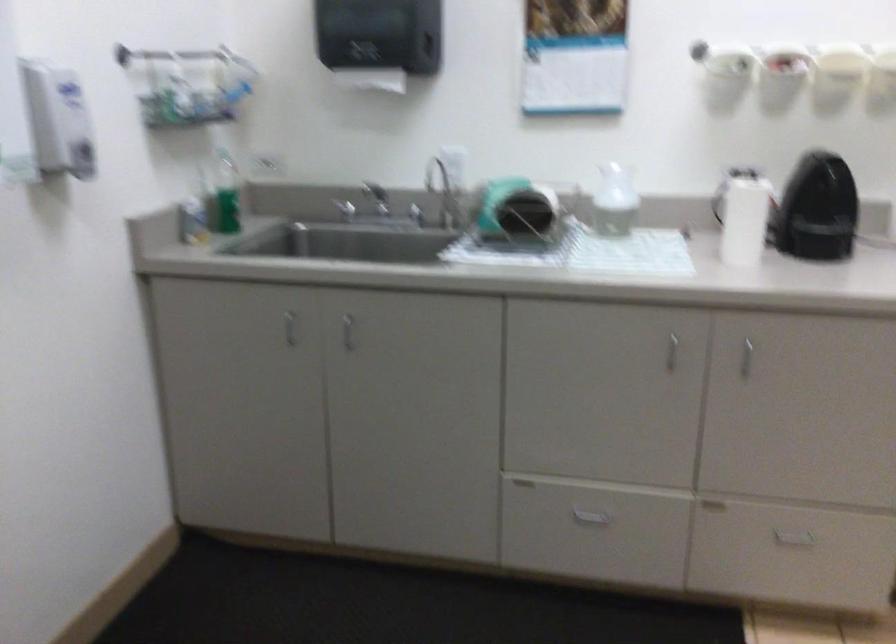
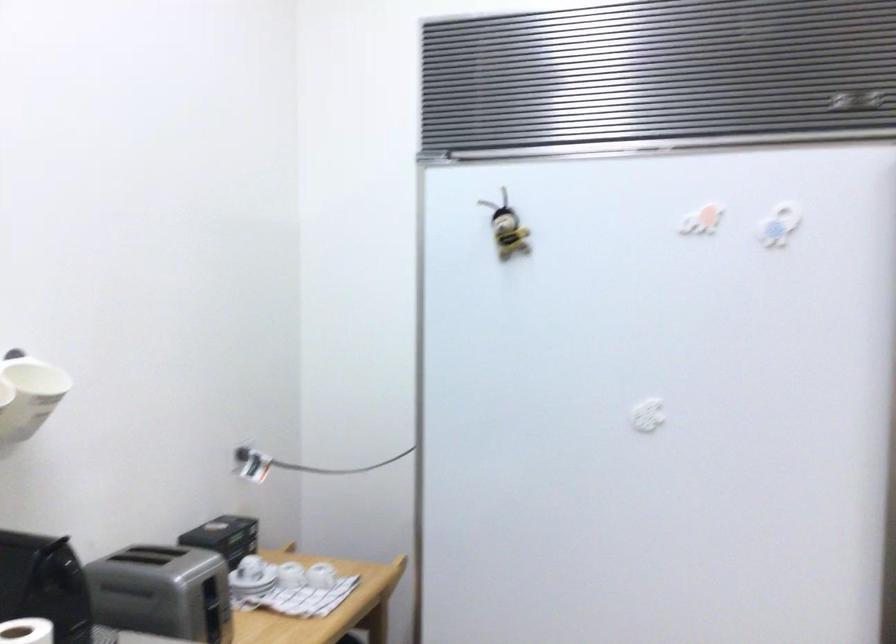
The point at (763, 180) is marked in the first image. Where is the corresponding point in the second image?

(26, 630)